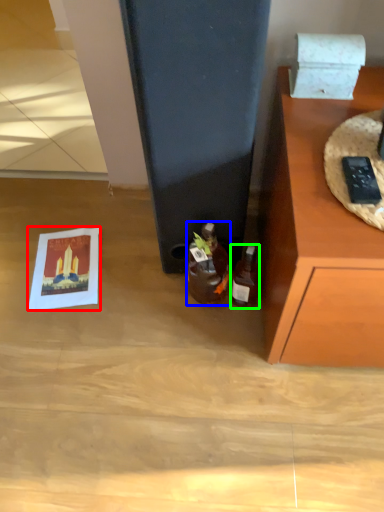
Question: Which object is the farthest from postcard (highlighted by a red box)? Choose among these: bottle (highlighted by a blue box) or bottle (highlighted by a green box).

Choices:
 (A) bottle
 (B) bottle

Answer: (B)